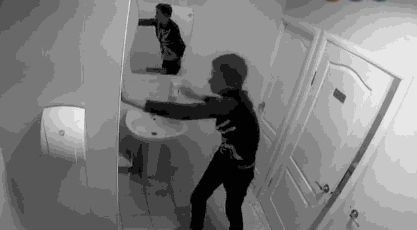
The height and width of the screenshot is (230, 417). I want to click on air dryer, so click(x=53, y=138).